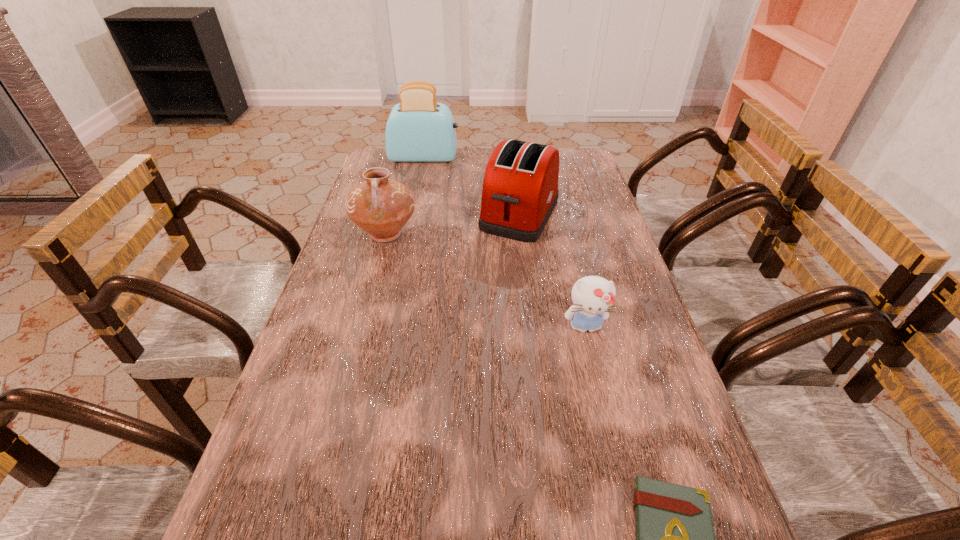
At what (x,y) coordinates should I click in order to perform the action: click on the farthest object. Please return your answer as a coordinate pair (x, y). The width and height of the screenshot is (960, 540). Looking at the image, I should click on (419, 129).

Find the location of a particular element. Image resolution: width=960 pixels, height=540 pixels. the taller toaster is located at coordinates (419, 129).

Find the location of a particular element. Image resolution: width=960 pixels, height=540 pixels. the right toaster is located at coordinates (520, 190).

In order to click on the shorter toaster in this screenshot , I will do `click(520, 190)`.

Identify the location of pottery. The image size is (960, 540). (380, 206).

Find the location of `kitten`. kitten is located at coordinates (592, 296).

This screenshot has width=960, height=540. What are the coordinates of `the fourth tallest object` in the screenshot? It's located at (592, 296).

Where is `vacant space located on the side of the left toaster with the lever`? The width and height of the screenshot is (960, 540). vacant space located on the side of the left toaster with the lever is located at coordinates (515, 158).

Image resolution: width=960 pixels, height=540 pixels. What are the coordinates of `free location located 0.320m on the left of the right toaster` in the screenshot? It's located at (377, 214).

Locate an element on the screen. Image resolution: width=960 pixels, height=540 pixels. vacant space located on the side of the pottery with the handle is located at coordinates (375, 274).